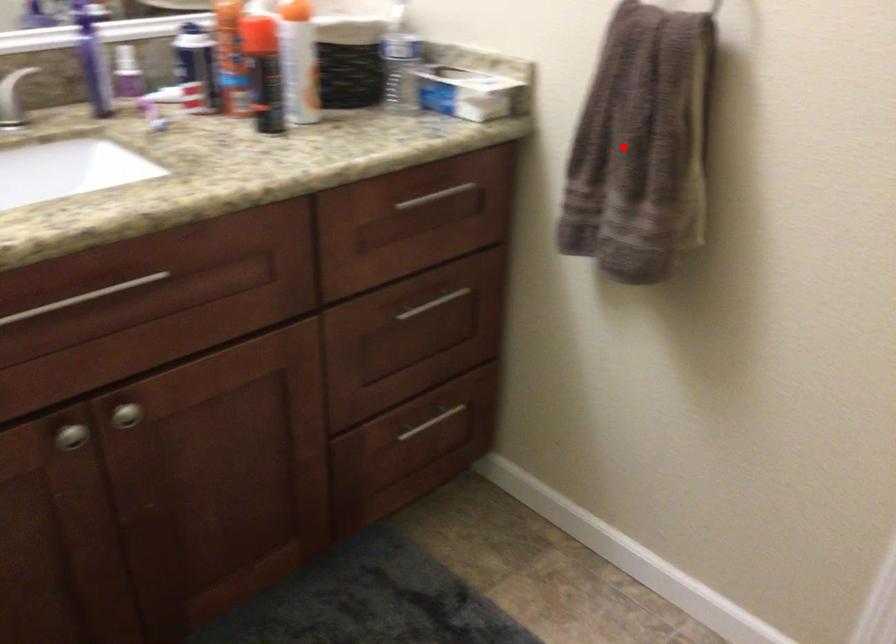
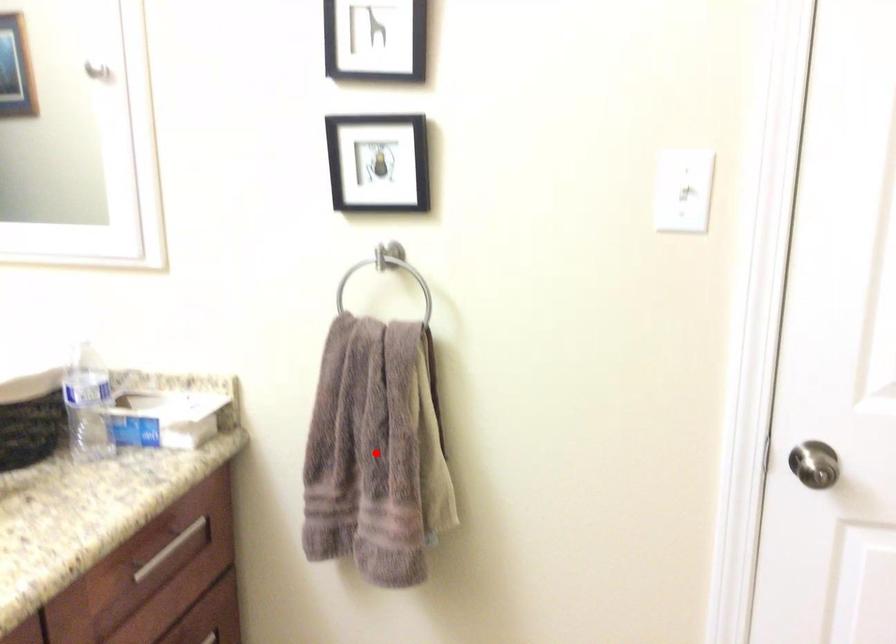
I am providing you with two images of the same scene from different viewpoints. A red point is marked on the first image and another point is marked on the second image. Are the points marked in image1 and image2 representing the same 3D position?

Yes